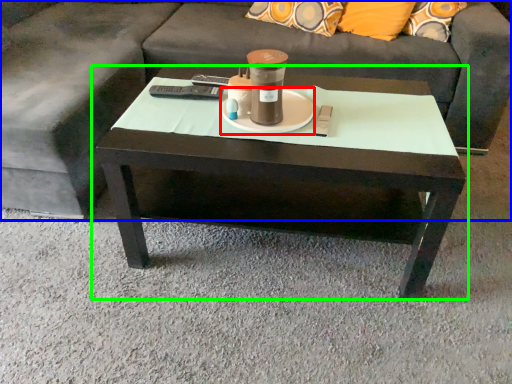
Question: Based on their relative distances, which object is farther from saucer (highlighted by a red box)? Choose from studio couch (highlighted by a blue box) and coffee table (highlighted by a green box).

Choices:
 (A) studio couch
 (B) coffee table

Answer: (A)